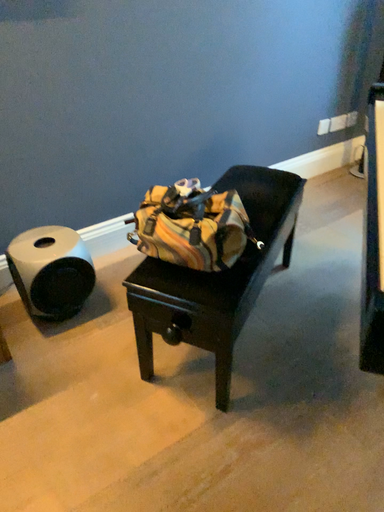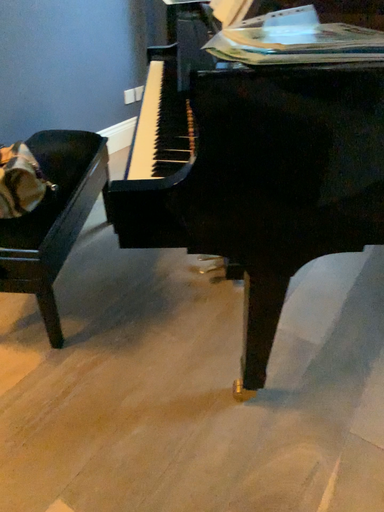
Question: How did the camera likely rotate when shooting the video?

Choices:
 (A) rotated left
 (B) rotated right

Answer: (B)